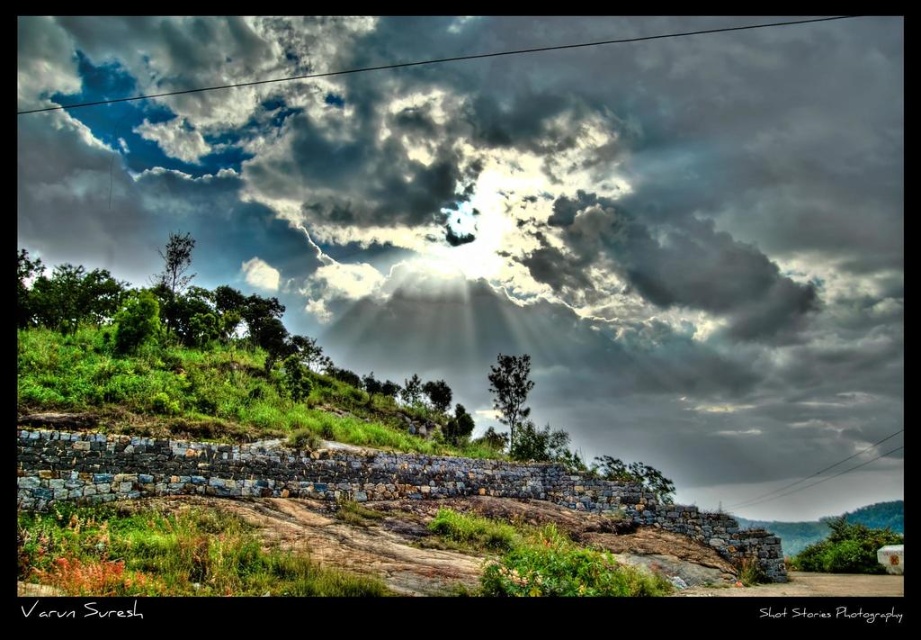
Question: Does cloudy sky at upper center have a lesser width compared to green leafy tree at lower right?

Choices:
 (A) yes
 (B) no

Answer: (B)

Question: Which of the following is the farthest from the observer?

Choices:
 (A) (500, 394)
 (B) (529, 170)
 (C) (825, 572)

Answer: (B)

Question: Which object is closer to the camera taking this photo?

Choices:
 (A) cloudy sky at upper center
 (B) dark green leafy tree at center

Answer: (B)

Question: Does cloudy sky at upper center come behind dark green leafy tree at center?

Choices:
 (A) no
 (B) yes

Answer: (B)

Question: Does green leafy tree at lower right appear on the right side of dark green leafy tree at center?

Choices:
 (A) yes
 (B) no

Answer: (A)

Question: Among these points, which one is farthest from the camera?

Choices:
 (A) (507, 397)
 (B) (580, 276)
 (C) (822, 557)

Answer: (B)